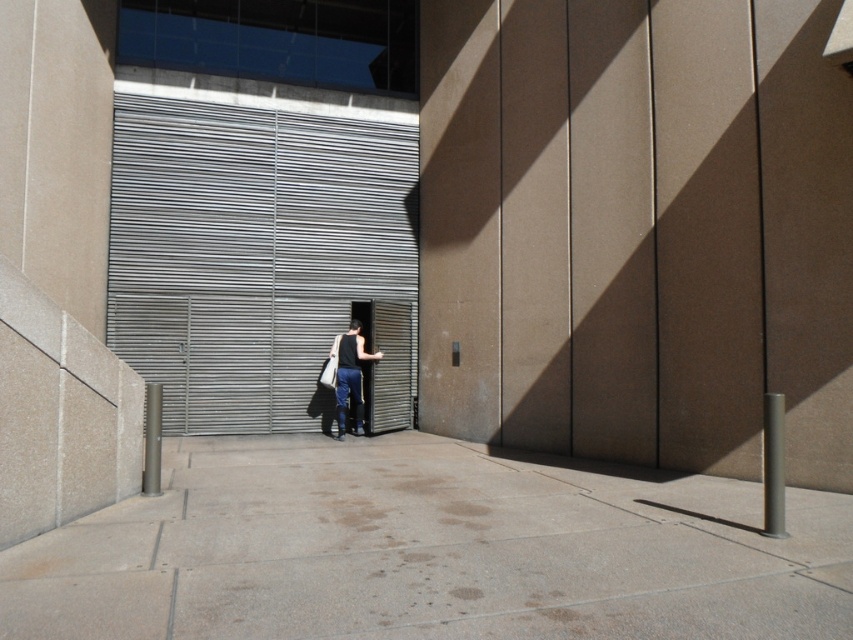
Can you confirm if dark gray jeans at center is thinner than white fabric shopping bag at center?

Incorrect, dark gray jeans at center's width is not less than white fabric shopping bag at center's.

Who is positioned more to the left, dark gray jeans at center or white fabric shopping bag at center?

From the viewer's perspective, white fabric shopping bag at center appears more on the left side.

Find the location of a particular element. Image resolution: width=853 pixels, height=640 pixels. dark gray jeans at center is located at coordinates (350, 376).

Find the location of `dark gray jeans at center`. dark gray jeans at center is located at coordinates (350, 376).

Which is behind, point (103, 541) or point (328, 356)?

Point (328, 356)

In the scene shown: Which is more to the right, concrete pavement at center or white fabric shopping bag at center?

From the viewer's perspective, concrete pavement at center appears more on the right side.

Where is `concrete pavement at center`? The height and width of the screenshot is (640, 853). concrete pavement at center is located at coordinates (428, 552).

At what (x,y) coordinates should I click in order to perform the action: click on concrete pavement at center. Please return your answer as a coordinate pair (x, y). Looking at the image, I should click on (428, 552).

Is concrete pavement at center thinner than metallic gray garage door at center?

Yes, concrete pavement at center is thinner than metallic gray garage door at center.

Is concrete pavement at center in front of metallic gray garage door at center?

Yes, it is in front of metallic gray garage door at center.

Is point (538, 500) positioned in front of point (308, 413)?

Yes, point (538, 500) is closer to viewer.

Locate an element on the screen. concrete pavement at center is located at coordinates (428, 552).